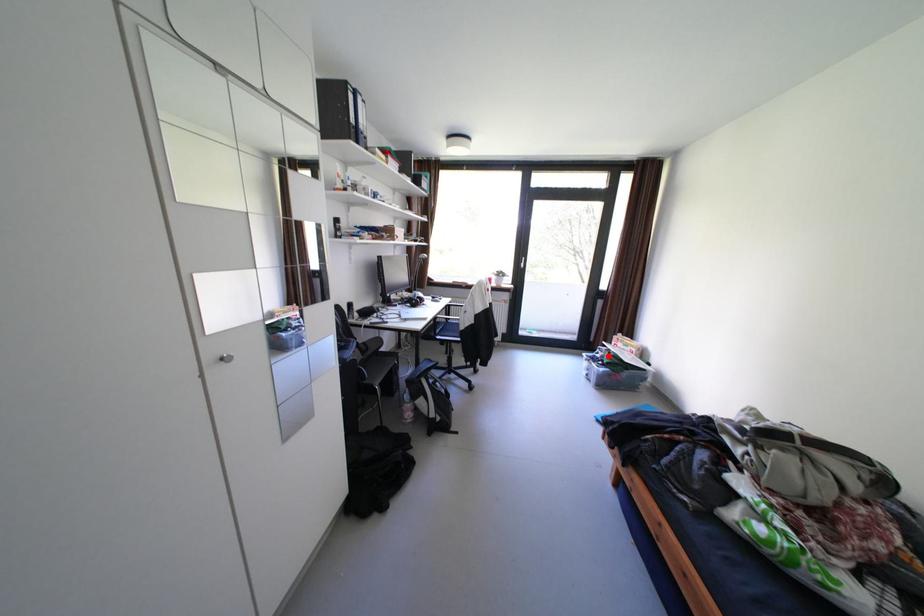
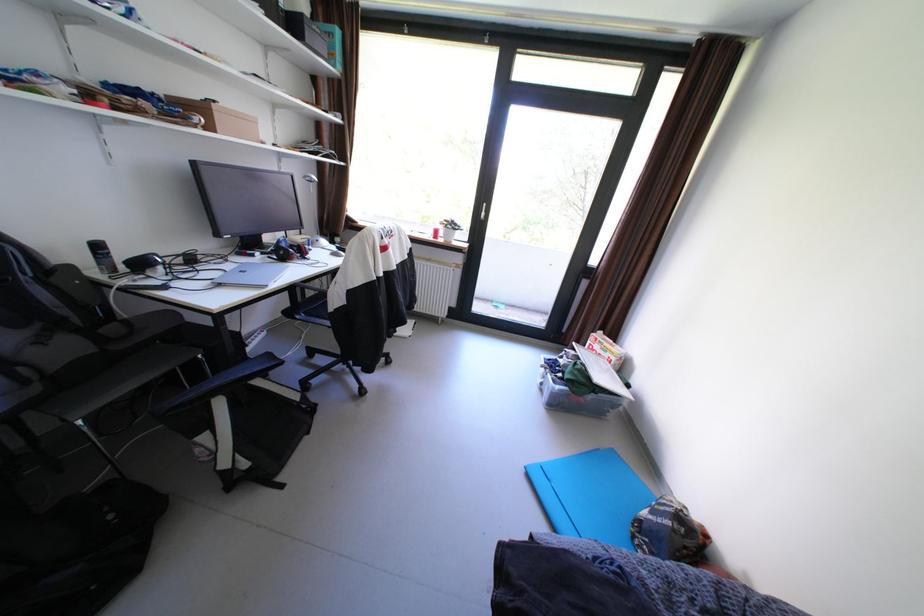
Find the pixel in the second image that matches the highlighted location in the first image.

(572, 361)